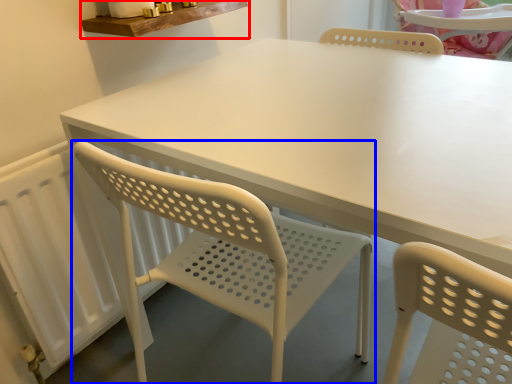
Question: Among these objects, which one is farthest to the camera, counter top (highlighted by a red box) or chair (highlighted by a blue box)?

Choices:
 (A) counter top
 (B) chair

Answer: (A)